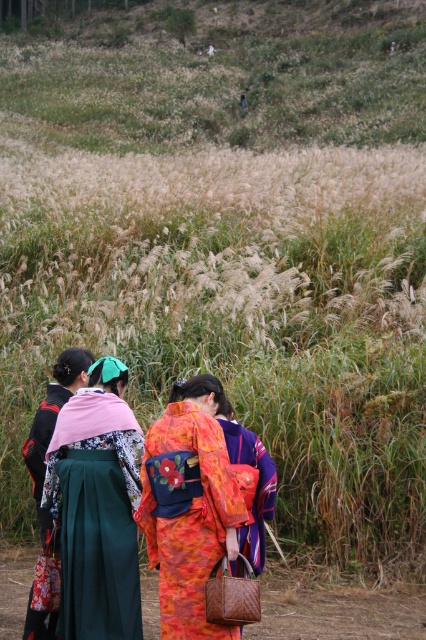
Who is higher up, floral kimono at center or matte black kimono at left?

Positioned higher is floral kimono at center.

Between point (180, 524) and point (46, 403), which one is positioned behind?

The point (46, 403) is more distant.

Where is `floral kimono at center`? The width and height of the screenshot is (426, 640). floral kimono at center is located at coordinates (189, 506).

Between green satin kimono at center and floral kimono at center, which one appears on the left side from the viewer's perspective?

green satin kimono at center is more to the left.

Is green satin kimono at center below floral kimono at center?

Indeed, green satin kimono at center is positioned under floral kimono at center.

Does point (115, 618) lie behind point (164, 515)?

Yes, it is behind point (164, 515).

Find the location of a particular element. green satin kimono at center is located at coordinates (97, 508).

Does orange silk kimono at center appear over matte black kimono at left?

Yes, orange silk kimono at center is above matte black kimono at left.

Is orange silk kimono at center to the left of matte black kimono at left from the viewer's perspective?

No, orange silk kimono at center is not to the left of matte black kimono at left.

Does point (265, 451) come in front of point (51, 524)?

That is True.

Where is `orange silk kimono at center`? orange silk kimono at center is located at coordinates (253, 490).